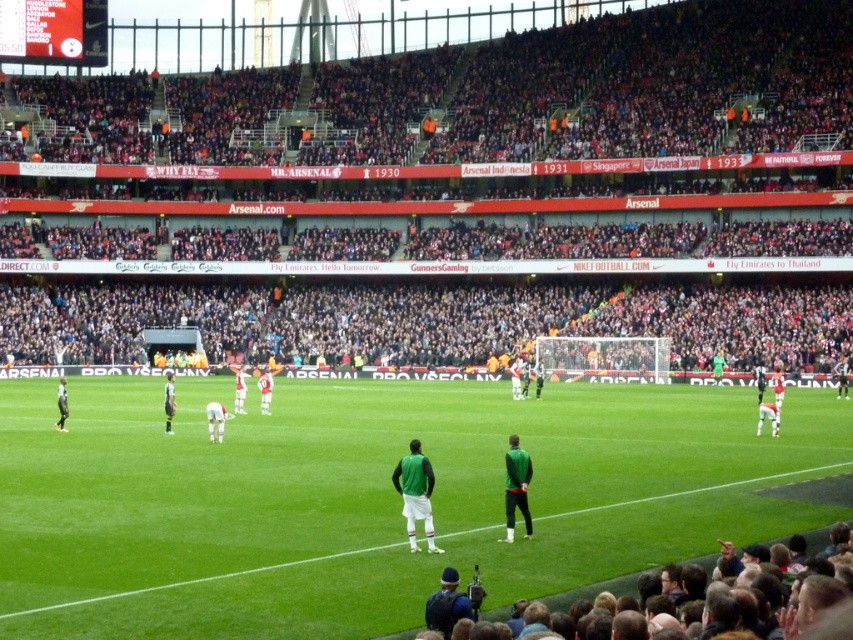
Locate an element on the screen. green grass field at center is located at coordinates tap(370, 499).

Is green grass field at center further to camera compared to green matte jersey at center?

No, green grass field at center is in front of green matte jersey at center.

The image size is (853, 640). Describe the element at coordinates (370, 499) in the screenshot. I see `green grass field at center` at that location.

The image size is (853, 640). I want to click on green grass field at center, so click(x=370, y=499).

Between point (515, 490) and point (221, 428), which one is positioned in front?

Point (515, 490) is more forward.

Does green matte jacket at center appear under white matte soccer player at center?

Yes.

What do you see at coordinates (515, 486) in the screenshot? I see `green matte jacket at center` at bounding box center [515, 486].

Locate an element on the screen. Image resolution: width=853 pixels, height=640 pixels. green matte jacket at center is located at coordinates (515, 486).

Which is more to the right, green matte jersey at center or green matte jacket at center?

Positioned to the right is green matte jacket at center.

Does green matte jersey at center have a smaller size compared to green matte jacket at center?

No, green matte jersey at center is not smaller than green matte jacket at center.

What do you see at coordinates (416, 493) in the screenshot? I see `green matte jersey at center` at bounding box center [416, 493].

Locate an element on the screen. This screenshot has height=640, width=853. green matte jersey at center is located at coordinates (416, 493).